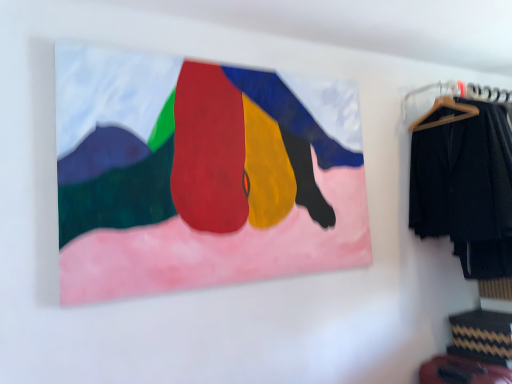
Question: Is black fabric pants at right spatially inside wooden hanger at upper right, or outside of it?

Choices:
 (A) inside
 (B) outside

Answer: (B)

Question: Is black fabric pants at right wider or thinner than wooden hanger at upper right?

Choices:
 (A) wide
 (B) thin

Answer: (A)

Question: Which is farther from the black fabric pants at right?

Choices:
 (A) matte canvas painting at upper center
 (B) wooden hanger at upper right

Answer: (A)

Question: Which object is the closest to the matte canvas painting at upper center?

Choices:
 (A) black fabric pants at right
 (B) wooden hanger at upper right

Answer: (A)